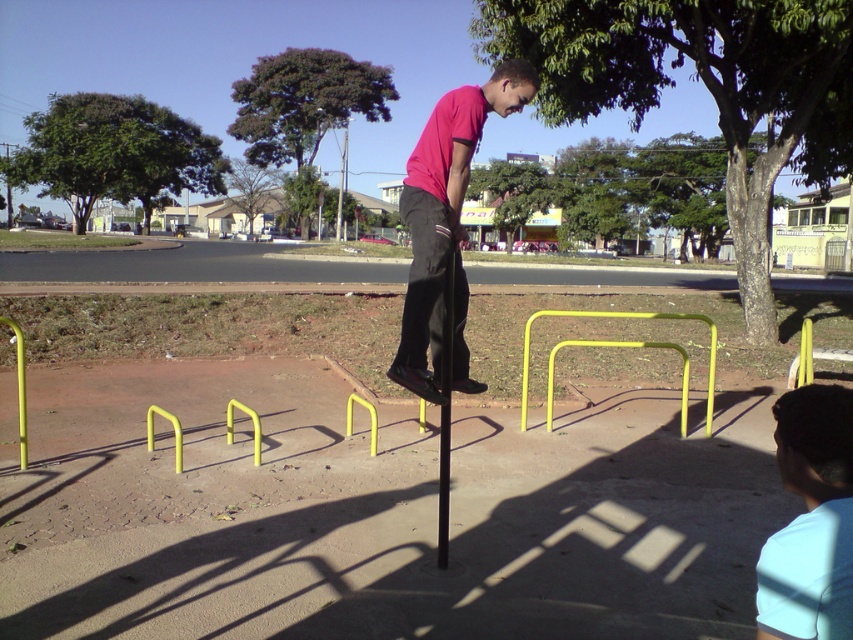
Question: In this image, where is matte pink shirt at center located relative to yellow matte hurdle at center?

Choices:
 (A) right
 (B) left

Answer: (B)

Question: Which point appears farthest from the camera in this image?

Choices:
 (A) (810, 492)
 (B) (453, 282)

Answer: (B)

Question: Which of these objects is positioned farthest from the yellow matte hurdle at center?

Choices:
 (A) matte pink shirt at center
 (B) light blue fabric at lower right

Answer: (B)

Question: Is light blue fabric at lower right in front of yellow matte hurdle at center?

Choices:
 (A) yes
 (B) no

Answer: (A)

Question: Based on their relative distances, which object is farther from the yellow matte hurdle at center?

Choices:
 (A) matte pink shirt at center
 (B) light blue fabric at lower right

Answer: (B)

Question: Can you confirm if matte pink shirt at center is bigger than yellow matte hurdle at center?

Choices:
 (A) no
 (B) yes

Answer: (B)